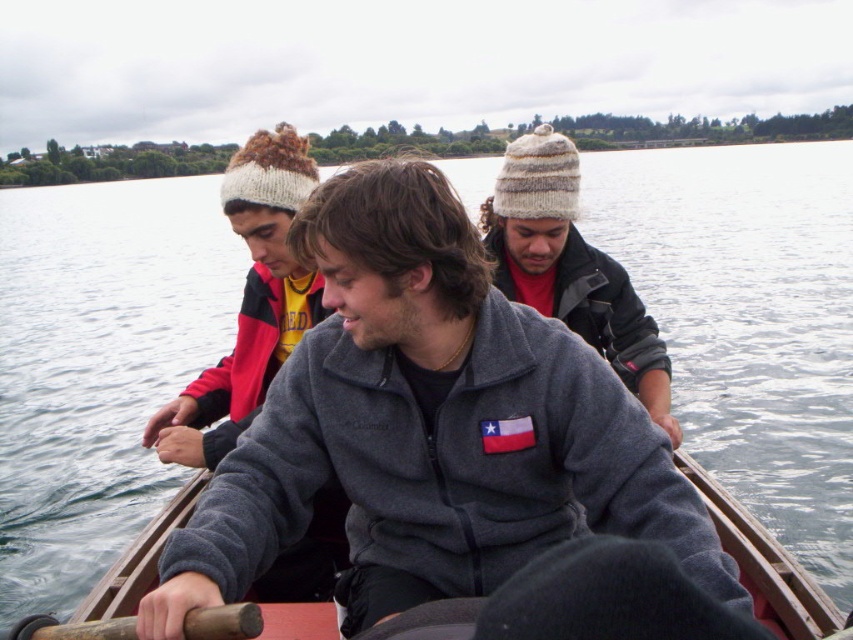
Can you confirm if knitted wool beanie at upper center is wider than wooden canoe at center?

Indeed, knitted wool beanie at upper center has a greater width compared to wooden canoe at center.

Is knitted wool beanie at upper center to the left of wooden canoe at center from the viewer's perspective?

Indeed, knitted wool beanie at upper center is positioned on the left side of wooden canoe at center.

I want to click on knitted wool beanie at upper center, so click(570, 266).

Which is above, knitted wool beanie at upper left or wooden paddle at lower left?

knitted wool beanie at upper left

Image resolution: width=853 pixels, height=640 pixels. What do you see at coordinates (248, 301) in the screenshot?
I see `knitted wool beanie at upper left` at bounding box center [248, 301].

The image size is (853, 640). What are the coordinates of `knitted wool beanie at upper left` in the screenshot? It's located at (248, 301).

Who is shorter, wooden canoe at center or wooden paddle at lower left?

With less height is wooden paddle at lower left.

Which is below, wooden canoe at center or wooden paddle at lower left?

wooden canoe at center is lower down.

I want to click on wooden canoe at center, so click(x=764, y=564).

The width and height of the screenshot is (853, 640). What are the coordinates of `wooden canoe at center` in the screenshot? It's located at (764, 564).